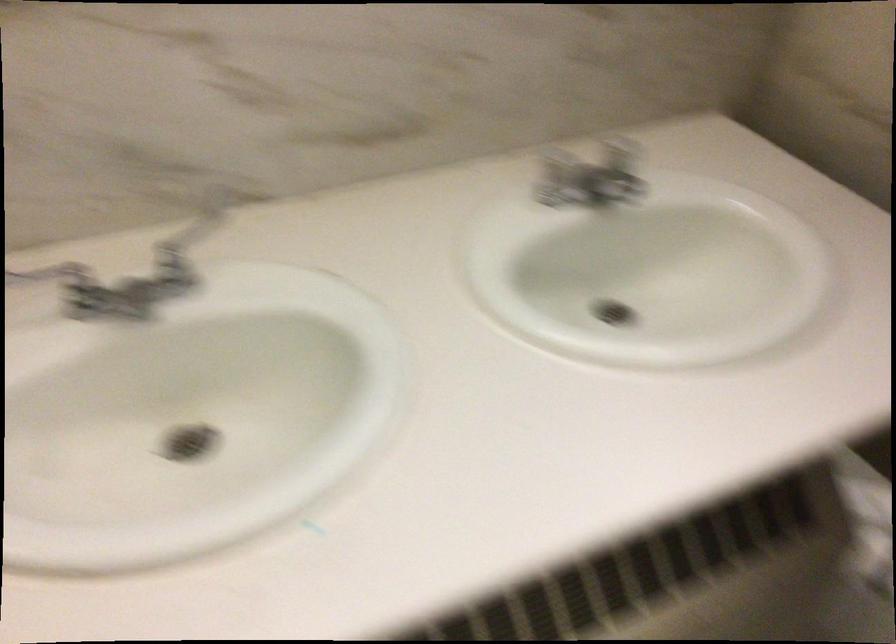
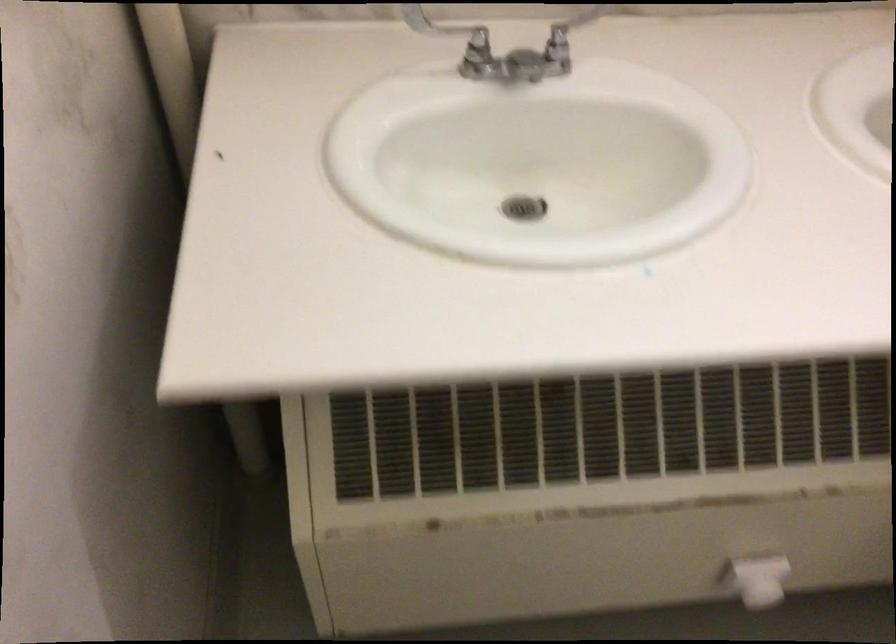
The point at (200, 232) is marked in the first image. Where is the corresponding point in the second image?

(558, 33)